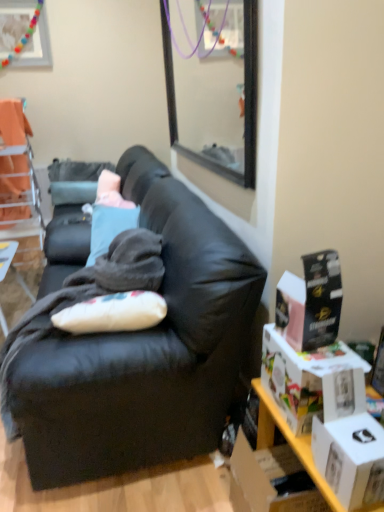
Question: Considering the positions of wooden picture frame at upper left and white matte box at lower right, the 1th box positioned from the bottom, in the image, is wooden picture frame at upper left taller or shorter than white matte box at lower right, the 1th box positioned from the bottom,?

Choices:
 (A) tall
 (B) short

Answer: (A)

Question: Considering the positions of point (23, 46) and point (375, 438), is point (23, 46) closer or farther from the camera than point (375, 438)?

Choices:
 (A) closer
 (B) farther

Answer: (B)

Question: Which object is the farthest from the black cardboard box at right, placed as the third box when sorted from bottom to top?

Choices:
 (A) black leather couch at center
 (B) wooden picture frame at upper left
 (C) orange fabric chair at upper left
 (D) wooden table at left
 (E) white matte box at lower right, the 1th box positioned from the bottom

Answer: (B)

Question: Which object is positioned closest to the white matte box at lower right, which ranks as the 3th box in top-to-bottom order?

Choices:
 (A) wooden table at left
 (B) white cardboard box at right, positioned as the 2th box in top-to-bottom order
 (C) wooden picture frame at upper left
 (D) black leather couch at center
 (E) orange fabric chair at upper left

Answer: (B)